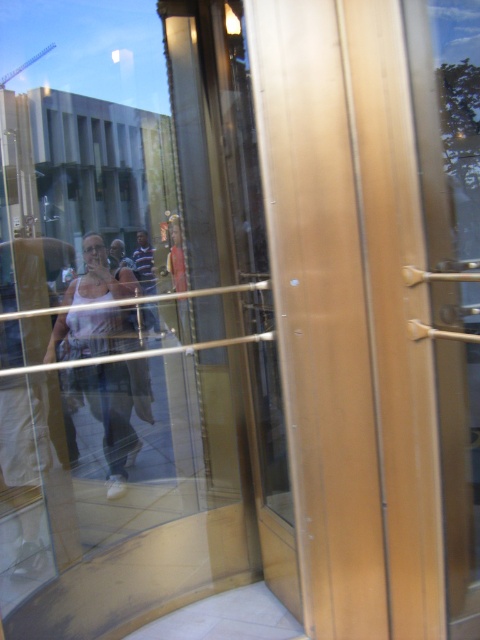
Does white matte tank top at center have a lesser width compared to striped shirt at center?

No, white matte tank top at center is not thinner than striped shirt at center.

Between point (86, 371) and point (148, 278), which one is positioned behind?

Point (148, 278)

Is point (69, 321) farther from viewer compared to point (143, 268)?

No.

Where is `white matte tank top at center`? The height and width of the screenshot is (640, 480). white matte tank top at center is located at coordinates (116, 412).

Which is in front, point (128, 296) or point (127, 262)?

Positioned in front is point (127, 262).

Between point (52, 348) and point (121, 256), which one is positioned behind?

Positioned behind is point (121, 256).

Is point (108, 429) closer to camera compared to point (110, 246)?

Yes.

At what (x,y) coordinates should I click in order to perform the action: click on white matte tank top at center. Please return your answer as a coordinate pair (x, y). The height and width of the screenshot is (640, 480). Looking at the image, I should click on (116, 412).

Looking at this image, between striped shirt at center and light brown leather jacket at center, which one appears on the left side from the viewer's perspective?

From the viewer's perspective, light brown leather jacket at center appears more on the left side.

Is striped shirt at center shorter than light brown leather jacket at center?

Incorrect, striped shirt at center's height does not fall short of light brown leather jacket at center's.

Who is more distant from viewer, (154,317) or (128,262)?

The point (128,262) is behind.

You are a GUI agent. You are given a task and a screenshot of the screen. Output one action in this format:
    pyautogui.click(x=<x>, y=<y>)
    Task: Click on the striped shirt at center
    This screenshot has height=640, width=480.
    Given the screenshot: What is the action you would take?
    pyautogui.click(x=144, y=262)